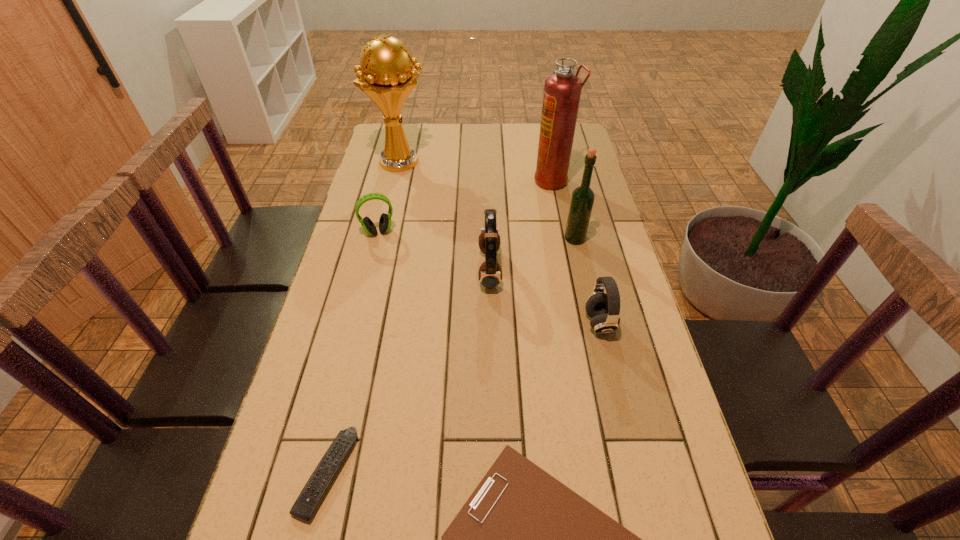
Locate an element on the screen. free space between the leftmost headset and the trophy_cup is located at coordinates click(x=390, y=197).

Locate an element on the screen. This screenshot has height=540, width=960. vacant space that is in between the second headset from right to left and the farthest headset is located at coordinates (434, 251).

Find the location of a particular element. The height and width of the screenshot is (540, 960). object that ranks as the second closest to the sixth shortest object is located at coordinates (562, 90).

Where is `the closest object to the clipboard`? the closest object to the clipboard is located at coordinates (305, 506).

This screenshot has width=960, height=540. Identify the location of headset that is the second nearest to the tallest headset. (385, 219).

Find the location of a particular element. This screenshot has height=540, width=960. headset that stands as the closest to the second headset from right to left is located at coordinates (603, 309).

What are the coordinates of `free spot that satisfies the following two spatial constraints: 1. on the side of the fire extinguisher with the label; 2. on the front side of the farthest headset` in the screenshot? It's located at tap(563, 232).